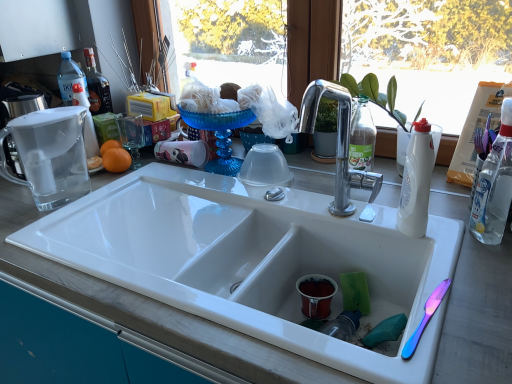
Question: Is matte white coffee cup at center, positioned as the 1th coffee cup in left-to-right order, taller or shorter than white plastic bottle at right, which is counted as the second bottle, starting from the left?

Choices:
 (A) short
 (B) tall

Answer: (A)

Question: Which is correct: matte white coffee cup at center, marked as the second coffee cup in a right-to-left arrangement, is inside white plastic bottle at right, acting as the 2th bottle starting from the front, or outside of it?

Choices:
 (A) inside
 (B) outside

Answer: (B)

Question: Which is farther from the orangesmoothfruit at left?

Choices:
 (A) green sponge at sink bottom
 (B) white ceramic sink at center
 (C) white plastic bottle at right, which is counted as the second bottle, starting from the left
 (D) matte ceramic cup at sink bottom, which is the 1th coffee cup from bottom to top
 (E) clear glass pitcher at upper left

Answer: (C)

Question: Which of these objects is positioned farthest from the matte ceramic cup at sink bottom, which is the 1th coffee cup from bottom to top?

Choices:
 (A) green sponge at sink bottom
 (B) white ceramic sink at center
 (C) matte white coffee cup at center, placed as the 1th coffee cup when sorted from top to bottom
 (D) clear plastic bottle at upper left, the 1th bottle positioned from the back
 (E) clear glass pitcher at upper left

Answer: (D)